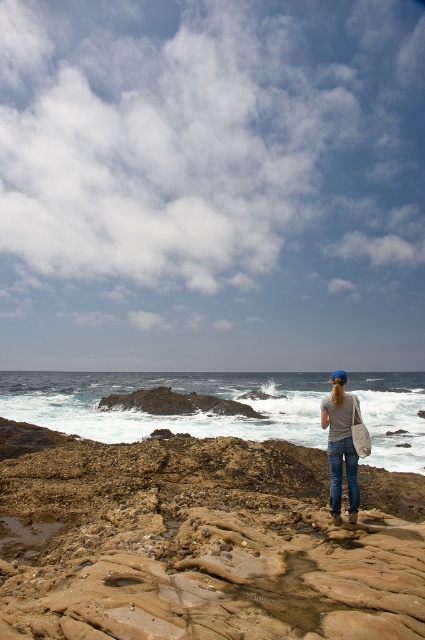
Question: Can you confirm if white foamy water at center is positioned above gray cotton shirt at center?

Choices:
 (A) no
 (B) yes

Answer: (A)

Question: Can you confirm if brown rock at center is positioned to the right of blue denim jeans at center?

Choices:
 (A) no
 (B) yes

Answer: (A)

Question: Which of the following is the farthest from the observer?

Choices:
 (A) white foamy water at center
 (B) brown rock at center
 (C) blue denim jeans at center

Answer: (C)

Question: Which is farther from the brown rock at center?

Choices:
 (A) blue denim jeans at center
 (B) white foamy water at center
 (C) gray cotton shirt at center

Answer: (B)

Question: Which object is positioned closest to the blue denim jeans at center?

Choices:
 (A) white foamy water at center
 (B) gray cotton shirt at center

Answer: (B)

Question: In this image, where is white foamy water at center located relative to blue denim jeans at center?

Choices:
 (A) below
 (B) above

Answer: (A)